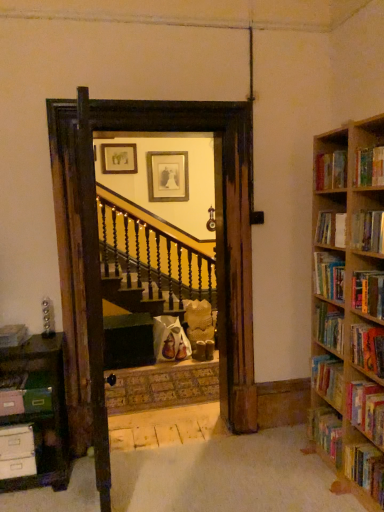
Question: Is hardcover book at right, the twelfth book viewed from the left, in front of or behind hardcover book at right, the 4th book viewed from the right, in the image?

Choices:
 (A) front
 (B) behind

Answer: (B)

Question: From the image's perspective, relative to hardcover book at right, the 4th book viewed from the right, is hardcover book at right, which is the first book from right to left, above or below?

Choices:
 (A) above
 (B) below

Answer: (B)

Question: Considering the real-world distances, which object is closest to the hardcover book at right, arranged as the 8th book when viewed from the left?

Choices:
 (A) hardcover book at right, placed as the 6th book when sorted from left to right
 (B) matte pink book at left, positioned as the 11th book in right-to-left order
 (C) matte gold picture frame at upper center, which is counted as the 2th picture frame, starting from the right
 (D) matte black bookshelf at left, placed as the 1th book when sorted from left to right
 (E) hardcover book at right, the 3th book positioned from the left

Answer: (E)

Question: Based on their relative distances, which object is nearer to the hardcover book at right, the 3th book when ordered from right to left?

Choices:
 (A) hardcover book at right, acting as the fifth book starting from the right
 (B) gold-framed picture at center, which appears as the 1th picture frame when viewed from the right
 (C) hardcover book at right, the 4th book viewed from the right
 (D) hardcover book at right, which is counted as the second book, starting from the right
 (E) hardcover book at right, the 9th book viewed from the right

Answer: (D)